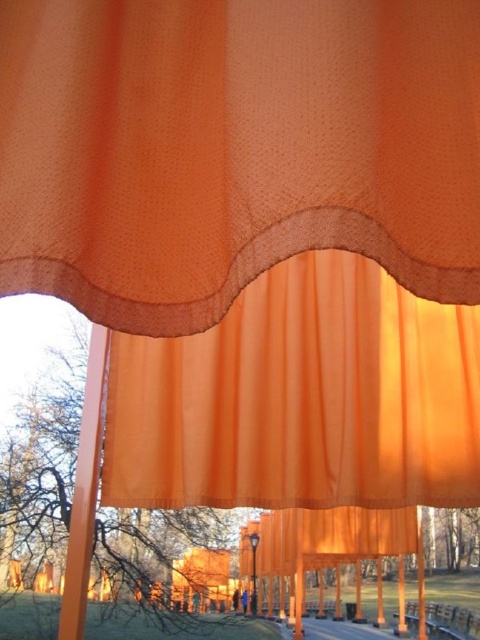
You are an interior designer planning to use the translucent orange curtain at upper center and the orange sheer curtain at center in a new project. Which curtain would allow more light to pass through?

The translucent orange curtain at upper center is thinner than the orange sheer curtain at center, so it would allow more light to pass through.

You are standing in front of the orange curtain installation and want to reach a point that is closer to you. Which point should you head towards, point (189, 264) or point (304, 307)?

You should head towards point (189, 264) because it is closer to the viewer than point (304, 307).

You are an interior designer planning to install two orange curtains in a room. You have the translucent orange curtain at upper center and the orange sheer curtain at center. Which curtain should you choose if you want the one that is larger in size?

The orange sheer curtain at center is larger in size compared to the translucent orange curtain at upper center, so you should choose the orange sheer curtain at center for the larger size.